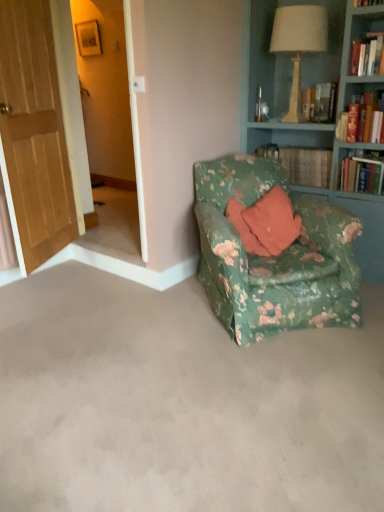
Question: Can you confirm if hardcover book at upper right, marked as the 2th book in a back-to-front arrangement, is bigger than wooden screen door at left?

Choices:
 (A) yes
 (B) no

Answer: (B)

Question: Does hardcover book at upper right, marked as the 2th book in a back-to-front arrangement, come in front of wooden screen door at left?

Choices:
 (A) no
 (B) yes

Answer: (A)

Question: Considering the relative sizes of hardcover book at upper right, marked as the 2th book in a back-to-front arrangement, and wooden screen door at left in the image provided, is hardcover book at upper right, marked as the 2th book in a back-to-front arrangement, taller than wooden screen door at left?

Choices:
 (A) yes
 (B) no

Answer: (B)

Question: Are hardcover book at upper right, marked as the 2th book in a back-to-front arrangement, and wooden screen door at left far apart?

Choices:
 (A) no
 (B) yes

Answer: (B)

Question: Would you say hardcover book at upper right, the 2th book in the front-to-back sequence, contains wooden screen door at left?

Choices:
 (A) no
 (B) yes

Answer: (A)

Question: Considering the relative sizes of hardcover book at upper right, marked as the 2th book in a back-to-front arrangement, and wooden screen door at left in the image provided, is hardcover book at upper right, marked as the 2th book in a back-to-front arrangement, shorter than wooden screen door at left?

Choices:
 (A) yes
 (B) no

Answer: (A)

Question: Is there a large distance between green floral fabric chair at lower right and floral fabric armchair at center?

Choices:
 (A) no
 (B) yes

Answer: (A)

Question: Is the position of green floral fabric chair at lower right less distant than that of floral fabric armchair at center?

Choices:
 (A) no
 (B) yes

Answer: (B)

Question: Considering the relative positions of green floral fabric chair at lower right and floral fabric armchair at center in the image provided, is green floral fabric chair at lower right behind floral fabric armchair at center?

Choices:
 (A) yes
 (B) no

Answer: (B)

Question: Is green floral fabric chair at lower right bigger than floral fabric armchair at center?

Choices:
 (A) no
 (B) yes

Answer: (A)

Question: Considering the relative positions of green floral fabric chair at lower right and floral fabric armchair at center in the image provided, is green floral fabric chair at lower right to the right of floral fabric armchair at center from the viewer's perspective?

Choices:
 (A) no
 (B) yes

Answer: (A)

Question: Can you confirm if green floral fabric chair at lower right is thinner than floral fabric armchair at center?

Choices:
 (A) yes
 (B) no

Answer: (B)

Question: From a real-world perspective, is wooden door at left located beneath green floral fabric chair at lower right?

Choices:
 (A) no
 (B) yes

Answer: (A)